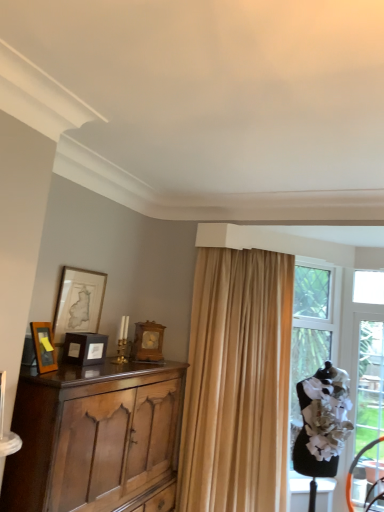
Question: From their relative heights in the image, would you say wooden clock at center, arranged as the first picture frame when viewed from the back, is taller or shorter than polished wood cabinet at left?

Choices:
 (A) short
 (B) tall

Answer: (A)

Question: Looking at the image, does wooden clock at center, arranged as the first picture frame when viewed from the back, seem bigger or smaller compared to polished wood cabinet at left?

Choices:
 (A) big
 (B) small

Answer: (B)

Question: Based on their relative distances, which object is farther from the matte gold picture frame at upper left, the second picture frame viewed from the back?

Choices:
 (A) matte black picture frame at center, which is the third picture frame from back to front
 (B) beige fabric curtain at center
 (C) clear glass door at right
 (D) polished wood cabinet at left
 (E) matte wooden picture frame at left, which is the fourth picture frame in back-to-front order

Answer: (C)

Question: Which of these objects is positioned closest to the clear glass door at right?

Choices:
 (A) matte gold picture frame at upper left, the second picture frame viewed from the back
 (B) beige fabric curtain at center
 (C) polished wood cabinet at left
 (D) wooden clock at center, the 4th picture frame in the front-to-back sequence
 (E) matte black picture frame at center, which is the third picture frame from back to front

Answer: (B)